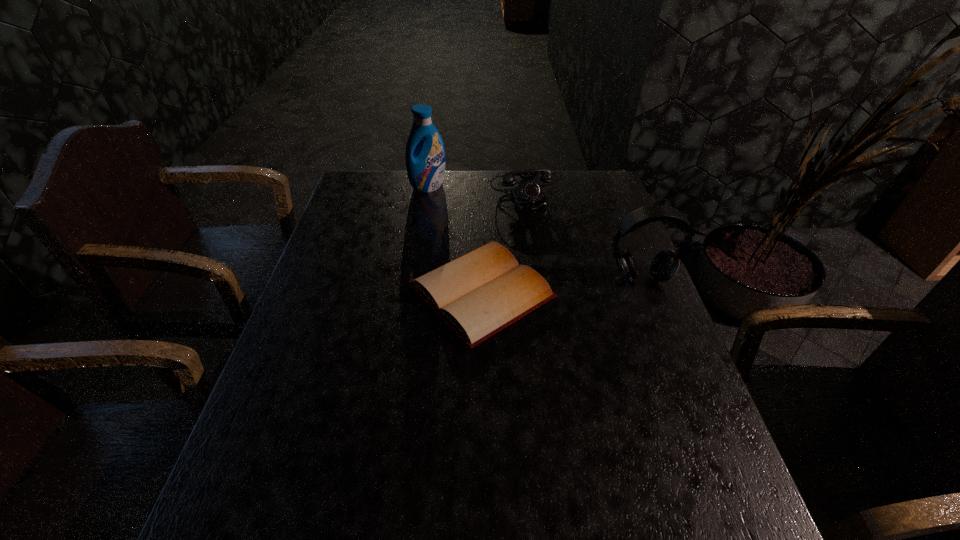
Find the location of a particular element. free point between the third tallest object and the third shortest object is located at coordinates (583, 234).

The height and width of the screenshot is (540, 960). Identify the location of free space between the second tallest object and the shortest object. (561, 285).

In order to click on object that stands as the closest to the earphone in this screenshot , I will do click(480, 293).

The width and height of the screenshot is (960, 540). Identify the location of the second closest object to the second tallest object. (x=528, y=196).